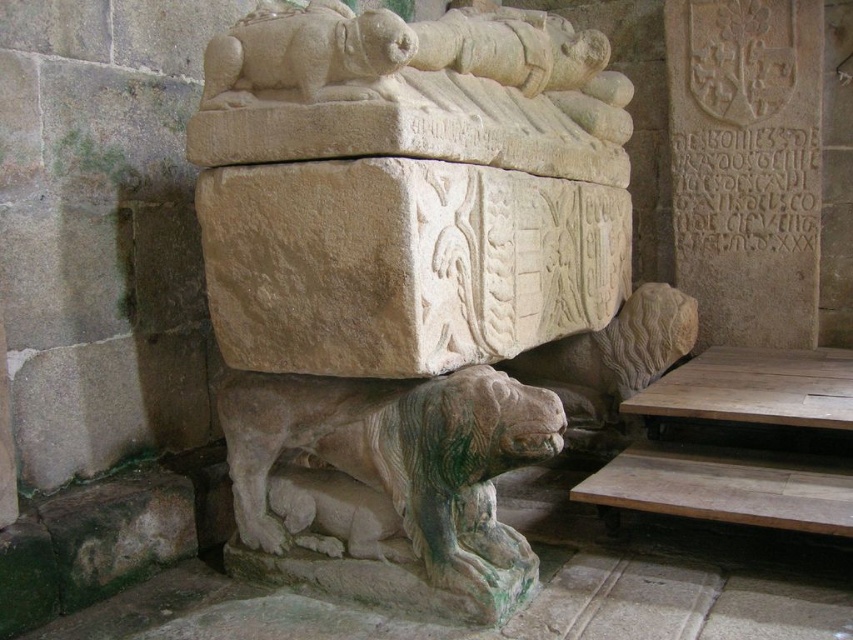
Who is positioned more to the left, stone lion statue at center or stone lion at upper center?

Positioned to the left is stone lion at upper center.

Can you confirm if stone lion statue at center is thinner than stone lion at upper center?

No, stone lion statue at center is not thinner than stone lion at upper center.

Is point (251, 472) farther from camera compared to point (302, 19)?

Yes, point (251, 472) is farther from viewer.

Identify the location of stone lion statue at center. tap(415, 288).

This screenshot has height=640, width=853. What do you see at coordinates (386, 484) in the screenshot?
I see `green stone lion at lower left` at bounding box center [386, 484].

Does point (409, 540) come farther from viewer compared to point (309, 76)?

That is True.

Between point (252, 525) and point (305, 97), which one is positioned in front?

Positioned in front is point (305, 97).

The image size is (853, 640). What are the coordinates of `green stone lion at lower left` in the screenshot? It's located at 386,484.

Who is shorter, stone lion statue at center or green stone lion at lower left?

Standing shorter between the two is green stone lion at lower left.

Does stone lion statue at center have a greater width compared to green stone lion at lower left?

Yes.

Measure the distance between point [370,420] and camera.

The distance of point [370,420] from camera is 1.99 meters.

At what (x,y) coordinates should I click in order to perform the action: click on stone lion statue at center. Please return your answer as a coordinate pair (x, y). The height and width of the screenshot is (640, 853). Looking at the image, I should click on (415, 288).